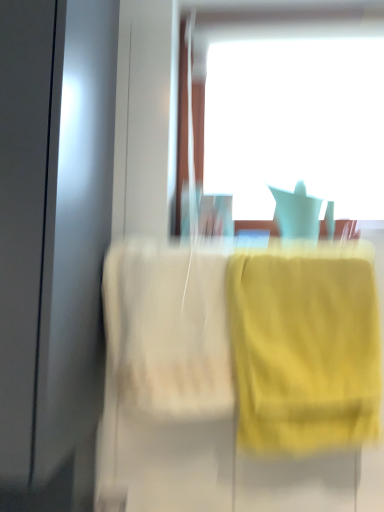
Question: Should I look upward or downward to see yellow fabric towel at right?

Choices:
 (A) down
 (B) up

Answer: (A)

Question: Considering the relative sizes of transparent glass window at upper center and yellow fabric towel at right in the image provided, is transparent glass window at upper center bigger than yellow fabric towel at right?

Choices:
 (A) yes
 (B) no

Answer: (A)

Question: Is transparent glass window at upper center thinner than yellow fabric towel at right?

Choices:
 (A) yes
 (B) no

Answer: (A)

Question: Is transparent glass window at upper center facing away from yellow fabric towel at right?

Choices:
 (A) no
 (B) yes

Answer: (A)

Question: Is there a large distance between transparent glass window at upper center and yellow fabric towel at right?

Choices:
 (A) no
 (B) yes

Answer: (A)

Question: Is transparent glass window at upper center aimed at yellow fabric towel at right?

Choices:
 (A) yes
 (B) no

Answer: (B)

Question: Can you confirm if transparent glass window at upper center is smaller than yellow fabric towel at right?

Choices:
 (A) no
 (B) yes

Answer: (A)

Question: Can you confirm if yellow fabric towel at right is positioned to the right of transparent glass window at upper center?

Choices:
 (A) yes
 (B) no

Answer: (B)

Question: Is yellow fabric towel at right taller than transparent glass window at upper center?

Choices:
 (A) yes
 (B) no

Answer: (B)

Question: From a real-world perspective, is yellow fabric towel at right on top of transparent glass window at upper center?

Choices:
 (A) yes
 (B) no

Answer: (B)

Question: Is yellow fabric towel at right far away from transparent glass window at upper center?

Choices:
 (A) no
 (B) yes

Answer: (A)

Question: From a real-world perspective, is yellow fabric towel at right positioned under transparent glass window at upper center based on gravity?

Choices:
 (A) yes
 (B) no

Answer: (A)

Question: Can we say yellow fabric towel at right lies outside transparent glass window at upper center?

Choices:
 (A) no
 (B) yes

Answer: (B)

Question: From the image's perspective, is transparent glass window at upper center positioned above or below yellow fabric towel at right?

Choices:
 (A) below
 (B) above

Answer: (B)